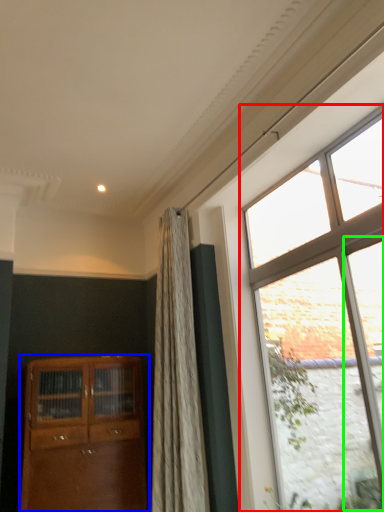
Question: Based on their relative distances, which object is farther from window (highlighted by a red box)? Choose from cabinetry (highlighted by a blue box) and glass door (highlighted by a green box).

Choices:
 (A) cabinetry
 (B) glass door

Answer: (A)